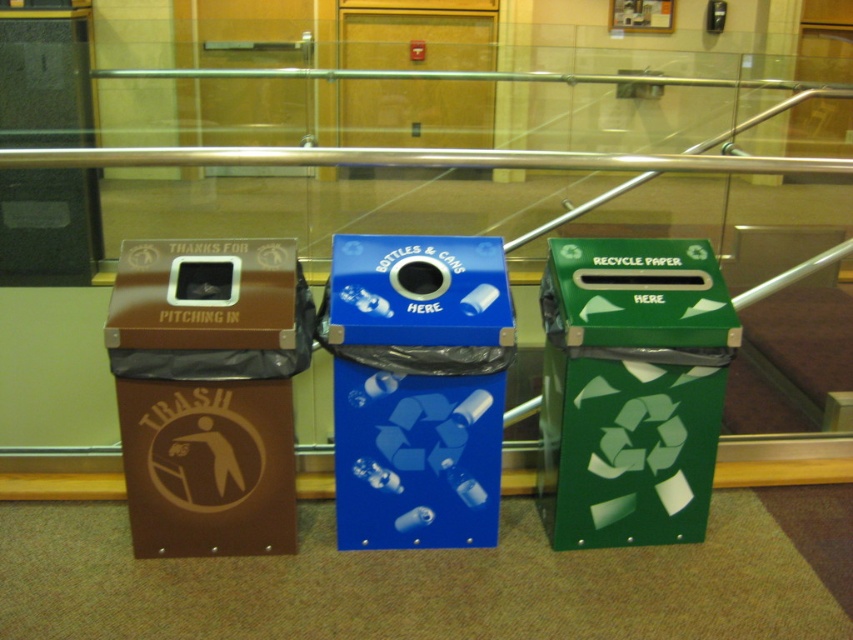
Is brown matte trash can at left wider than green glossy recycle bin at right?

Yes, brown matte trash can at left is wider than green glossy recycle bin at right.

Between point (305, 294) and point (709, 348), which one is positioned in front?

Positioned in front is point (709, 348).

At what (x,y) coordinates should I click in order to perform the action: click on brown matte trash can at left. Please return your answer as a coordinate pair (x, y). This screenshot has width=853, height=640. Looking at the image, I should click on (207, 392).

Is point (700, 260) in front of point (440, 253)?

No, it is behind (440, 253).

Does green glossy recycle bin at right appear under blue glossy plastic recycling bin at center?

Yes.

Where is `green glossy recycle bin at right`? green glossy recycle bin at right is located at coordinates (631, 388).

Is brown matte trash can at left further to the viewer compared to blue glossy plastic recycling bin at center?

No, it is in front of blue glossy plastic recycling bin at center.

How distant is brown matte trash can at left from blue glossy plastic recycling bin at center?

25.96 centimeters

Does point (274, 317) come in front of point (468, 260)?

That is True.

At what (x,y) coordinates should I click in order to perform the action: click on brown matte trash can at left. Please return your answer as a coordinate pair (x, y). Looking at the image, I should click on (207, 392).